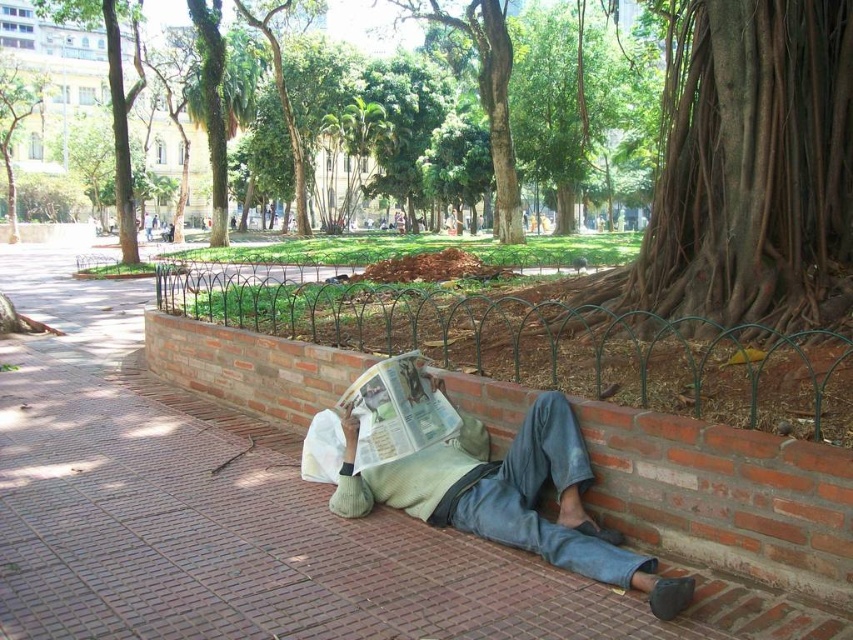
You are standing in the park and want to take a photo of the green leafy tree at upper center without the light green sweater at lower center blocking the view. Is this possible based on their positions?

The green leafy tree at upper center is further to the viewer than the light green sweater at lower center, so you can take a photo of the green leafy tree at upper center without the light green sweater at lower center blocking the view because it is closer to you.

You are a park maintenance worker who needs to locate the brown rough bark at upper right. According to the image, where exactly would you find it?

The brown rough bark at upper right is located at the 2D coordinates point (747, 170) in the image.

You are a park visitor who wants to place a small potted plant between the brown rough bark at upper right and the light green sweater at lower center. Based on their widths, which object should you place the plant closer to?

The brown rough bark at upper right has a lesser width compared to the light green sweater at lower center, so you should place the plant closer to the brown rough bark at upper right to ensure proper spacing.